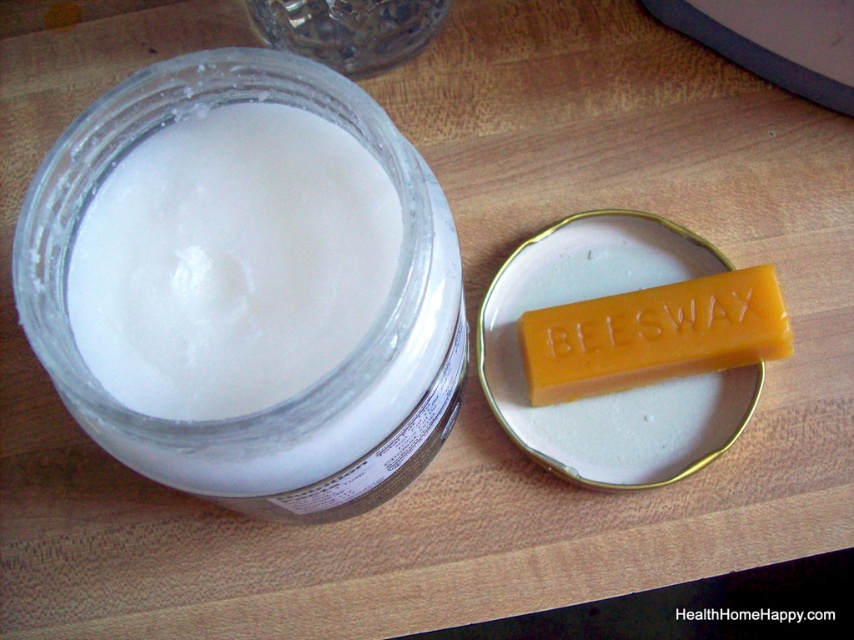
You are organizing items on a table and need to place both the yellow beeswax bar at center and the transparent glass jar at upper center. Based on the current arrangement, which item is located below the other?

The yellow beeswax bar at center is positioned under the transparent glass jar at upper center.

You are arranging items on a table and want to place a decorative plate between the white matte jar at center and the yellow beeswax bar at center. Based on their positions, where should you place the plate to ensure it is between them?

The white matte jar at center is closer to the viewer than the yellow beeswax bar at center. Therefore, you should place the decorative plate in front of the white matte jar at center and behind the yellow beeswax bar at center to position it between them.

You are organizing a skincare routine and have both the white matte jar at center and the yellow beeswax bar at center on your table. To ensure proper storage, you need to place them back in their original positions. Which item was originally on the left side?

The white matte jar at center was originally on the left side of the yellow beeswax bar at center.